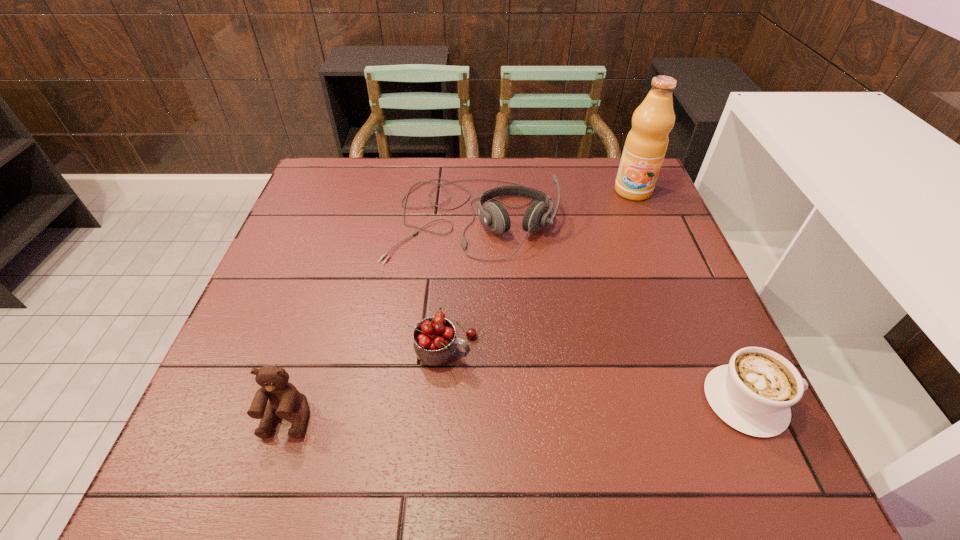
Locate an element on the screen. free spot located 0.070m on the front label of the fruit juice is located at coordinates (626, 216).

Where is `vacant space located 0.070m on the handle side of the pot filled with cherries`? vacant space located 0.070m on the handle side of the pot filled with cherries is located at coordinates 505,376.

What are the coordinates of `free space located on the handle side of the pot filled with cherries` in the screenshot? It's located at (548, 396).

Where is `blank space located 0.210m on the handle side of the pot filled with cherries`? blank space located 0.210m on the handle side of the pot filled with cherries is located at coordinates (574, 409).

This screenshot has height=540, width=960. What are the coordinates of `headset located at the far edge` in the screenshot? It's located at (494, 215).

Where is `fruit juice that is at the far edge`? Image resolution: width=960 pixels, height=540 pixels. fruit juice that is at the far edge is located at coordinates (646, 144).

At what (x,y) coordinates should I click in order to perform the action: click on teddy bear that is at the near edge. Please return your answer as a coordinate pair (x, y). Looking at the image, I should click on (284, 398).

I want to click on cappuccino that is at the near edge, so click(x=753, y=393).

Find the location of a particular element. pot filled with cherries present at the near edge is located at coordinates (435, 343).

At what (x,y) coordinates should I click in order to perform the action: click on object at the left edge. Please return your answer as a coordinate pair (x, y). The height and width of the screenshot is (540, 960). Looking at the image, I should click on (284, 398).